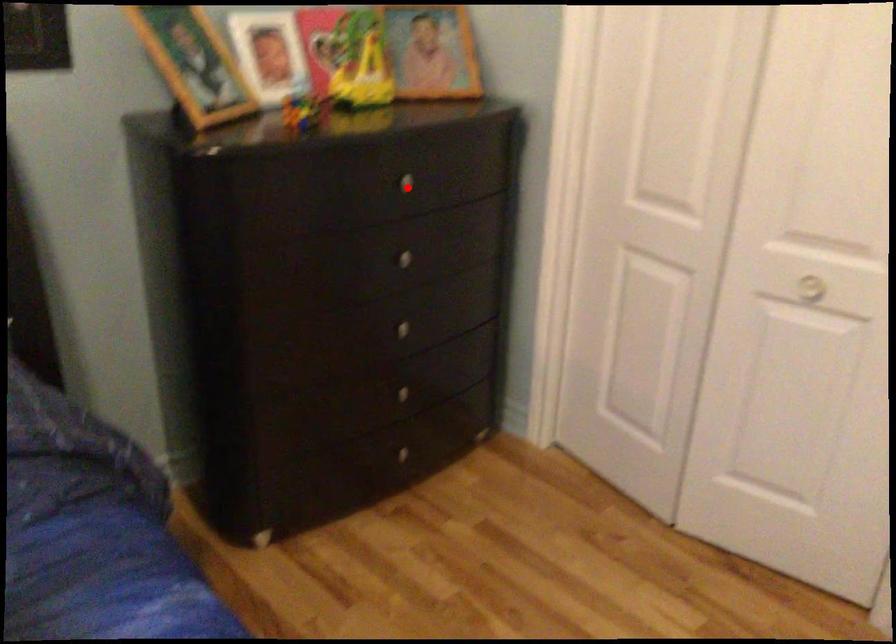
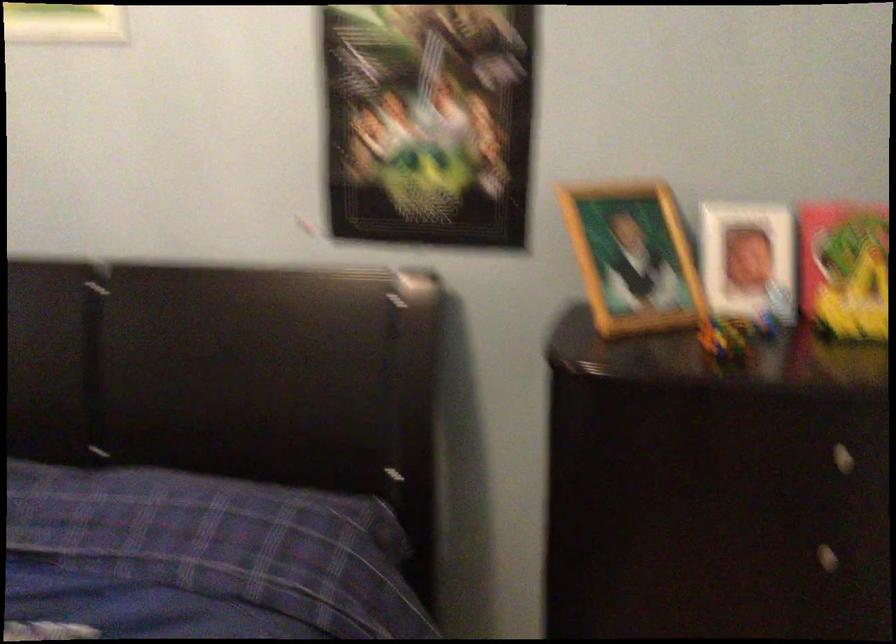
In the second image, find the point that corresponds to the highlighted location in the first image.

(840, 458)